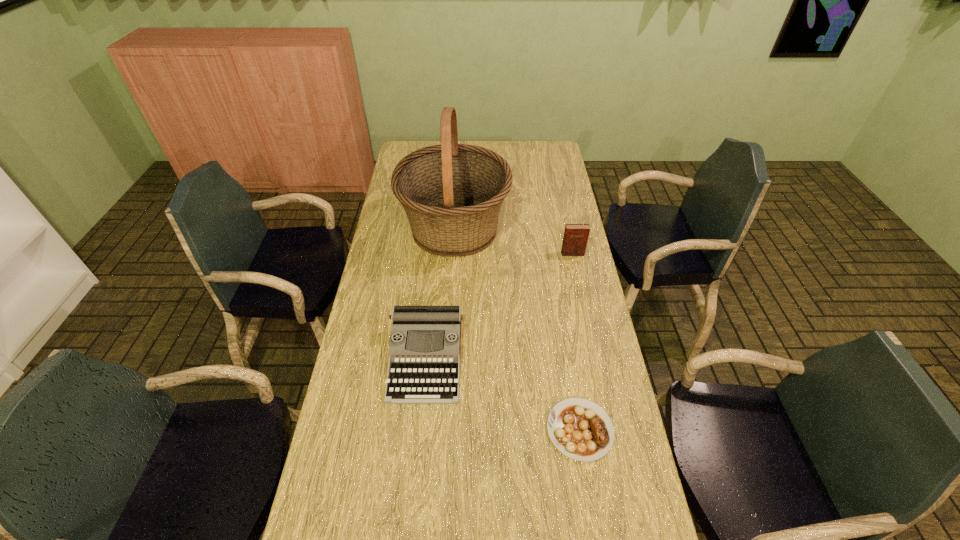
Find the location of a particular element. The width and height of the screenshot is (960, 540). diary positioned at the right edge is located at coordinates (575, 239).

I want to click on steak present at the right edge, so [580, 429].

Locate an element on the screen. The height and width of the screenshot is (540, 960). vacant space at the left edge is located at coordinates (365, 333).

The width and height of the screenshot is (960, 540). What are the coordinates of `vacant space at the right edge of the desktop` in the screenshot? It's located at (564, 336).

Identify the location of free space at the far right corner. (553, 140).

This screenshot has width=960, height=540. In order to click on unoccupied area between the basket and the steak in this screenshot , I will do (517, 329).

Identify the location of free spot between the diary and the second shortest object. The image size is (960, 540). (499, 306).

What are the coordinates of `empty space that is in between the diary and the typewriter` in the screenshot? It's located at (499, 306).

This screenshot has width=960, height=540. Find the location of `vacant space that's between the tallest object and the diary`. vacant space that's between the tallest object and the diary is located at coordinates pos(514,241).

You are a GUI agent. You are given a task and a screenshot of the screen. Output one action in this format:
    pyautogui.click(x=<x>, y=<y>)
    Task: Click on the free space between the second shortest object and the second tallest object
    
    Given the screenshot: What is the action you would take?
    pyautogui.click(x=499, y=306)